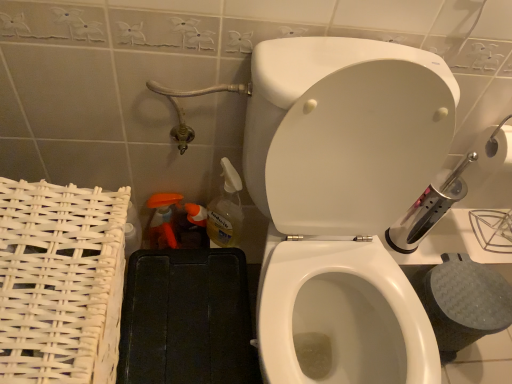
Question: Is white glossy toilet at center behind translucent plastic spray bottle at lower left, which is counted as the 3th cleaning product, starting from the right?

Choices:
 (A) yes
 (B) no

Answer: (B)

Question: Considering the relative sizes of white glossy toilet at center and translucent plastic spray bottle at lower left, which is counted as the 3th cleaning product, starting from the right, in the image provided, is white glossy toilet at center shorter than translucent plastic spray bottle at lower left, which is counted as the 3th cleaning product, starting from the right,?

Choices:
 (A) no
 (B) yes

Answer: (A)

Question: Can you confirm if white glossy toilet at center is bigger than translucent plastic spray bottle at lower left, which is counted as the 3th cleaning product, starting from the right?

Choices:
 (A) no
 (B) yes

Answer: (B)

Question: From a real-world perspective, is white glossy toilet at center positioned over translucent plastic spray bottle at lower left, which is counted as the 3th cleaning product, starting from the right, based on gravity?

Choices:
 (A) no
 (B) yes

Answer: (B)

Question: From the image's perspective, is white glossy toilet at center above translucent plastic spray bottle at lower left, which is counted as the 3th cleaning product, starting from the right?

Choices:
 (A) no
 (B) yes

Answer: (A)

Question: Considering their positions, is white glossy toilet at center located in front of or behind translucent plastic spray bottle at lower left, which is counted as the 3th cleaning product, starting from the right?

Choices:
 (A) behind
 (B) front

Answer: (B)

Question: In terms of height, does white glossy toilet at center look taller or shorter compared to translucent plastic spray bottle at lower left, which is counted as the 1th cleaning product, starting from the left?

Choices:
 (A) tall
 (B) short

Answer: (A)

Question: In the image, is white glossy toilet at center on the left side or the right side of translucent plastic spray bottle at lower left, which is counted as the 1th cleaning product, starting from the left?

Choices:
 (A) right
 (B) left

Answer: (A)

Question: From a real-world perspective, is white glossy toilet at center above or below translucent plastic spray bottle at lower left, which is counted as the 3th cleaning product, starting from the right?

Choices:
 (A) above
 (B) below

Answer: (A)

Question: Looking at the image, does translucent plastic spray bottle at lower center, which is the 3th cleaning product from left to right, seem bigger or smaller compared to orange plastic spray bottle at lower left, the 2th cleaning product when ordered from right to left?

Choices:
 (A) big
 (B) small

Answer: (A)

Question: Is translucent plastic spray bottle at lower center, placed as the 1th cleaning product when sorted from right to left, taller or shorter than orange plastic spray bottle at lower left, the 2th cleaning product when ordered from right to left?

Choices:
 (A) tall
 (B) short

Answer: (A)

Question: Considering the positions of point (228, 233) and point (185, 230), is point (228, 233) closer or farther from the camera than point (185, 230)?

Choices:
 (A) closer
 (B) farther

Answer: (A)

Question: Looking at their shapes, would you say translucent plastic spray bottle at lower center, placed as the 1th cleaning product when sorted from right to left, is wider or thinner than orange plastic spray bottle at lower left, acting as the second cleaning product starting from the left?

Choices:
 (A) thin
 (B) wide

Answer: (B)

Question: Considering the relative positions of translucent plastic spray bottle at lower center, placed as the 1th cleaning product when sorted from right to left, and white glossy toilet at center in the image provided, is translucent plastic spray bottle at lower center, placed as the 1th cleaning product when sorted from right to left, to the left or to the right of white glossy toilet at center?

Choices:
 (A) left
 (B) right

Answer: (A)

Question: In terms of width, does translucent plastic spray bottle at lower center, placed as the 1th cleaning product when sorted from right to left, look wider or thinner when compared to white glossy toilet at center?

Choices:
 (A) wide
 (B) thin

Answer: (B)